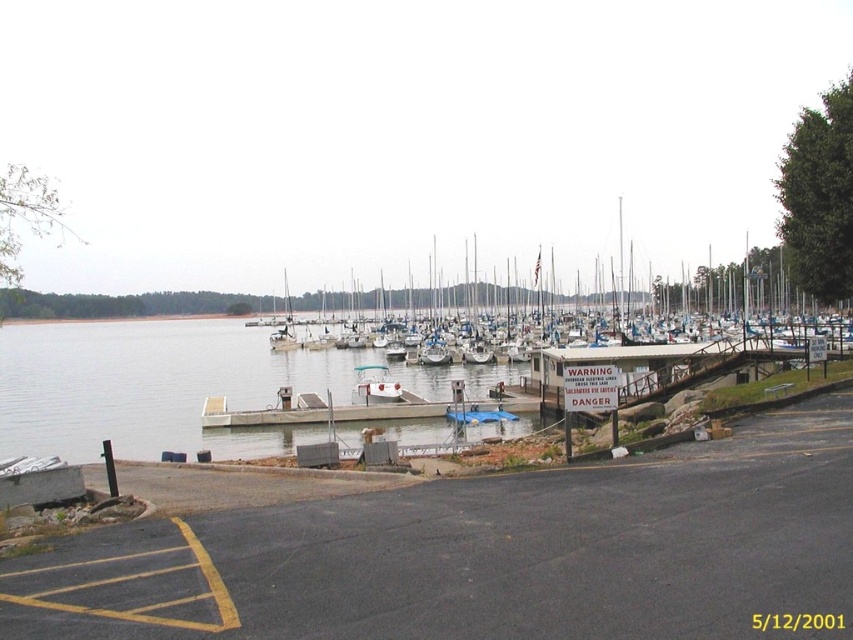
Question: Can you confirm if white matte boats at center is wider than white matte sailboat at center?

Choices:
 (A) no
 (B) yes

Answer: (B)

Question: Which object is farther from the camera taking this photo?

Choices:
 (A) white matte boats at center
 (B) white matte sailboat at center

Answer: (B)

Question: Which point is closer to the camera taking this photo?

Choices:
 (A) (779, 262)
 (B) (814, 403)

Answer: (B)

Question: Which of the following is the closest to the observer?

Choices:
 (A) (383, 387)
 (B) (589, 616)

Answer: (B)

Question: Is black asphalt parking lot at lower left above white matte sailboat at center?

Choices:
 (A) yes
 (B) no

Answer: (A)

Question: Can you confirm if black asphalt parking lot at lower left is wider than white matte sailboat at center?

Choices:
 (A) no
 (B) yes

Answer: (B)